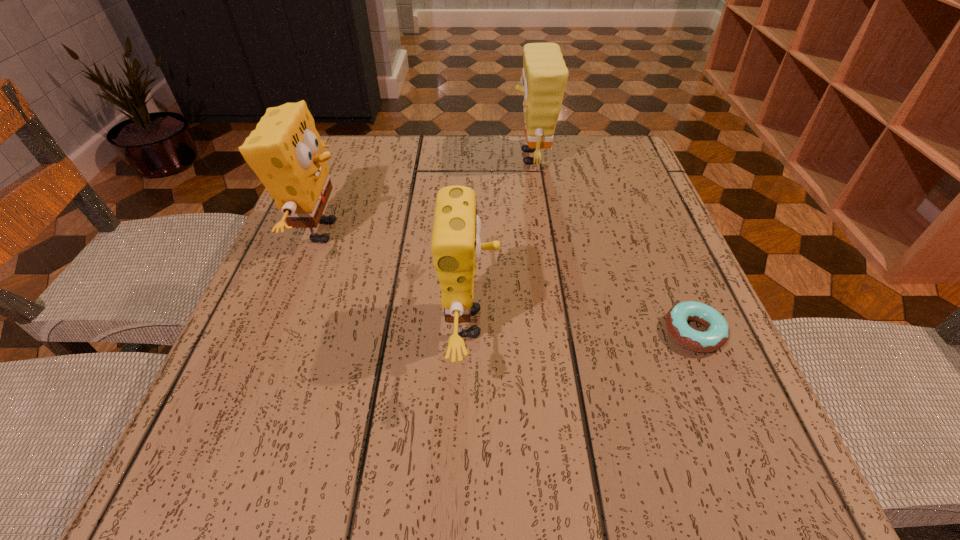
At what (x,y) coordinates should I click in order to perform the action: click on vacant space that satisfies the following two spatial constraints: 1. on the face of the farthest object; 2. on the back side of the rightmost object. Please return your answer as a coordinate pair (x, y). The height and width of the screenshot is (540, 960). Looking at the image, I should click on (558, 332).

Locate an element on the screen. The width and height of the screenshot is (960, 540). vacant space that satisfies the following two spatial constraints: 1. on the face of the farthest sponge; 2. on the right side of the shortest object is located at coordinates (558, 332).